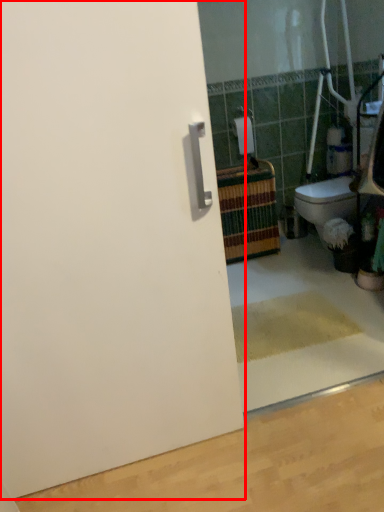
Question: Where is door (annotated by the red box) located in relation to toilet paper in the image?

Choices:
 (A) left
 (B) right

Answer: (A)